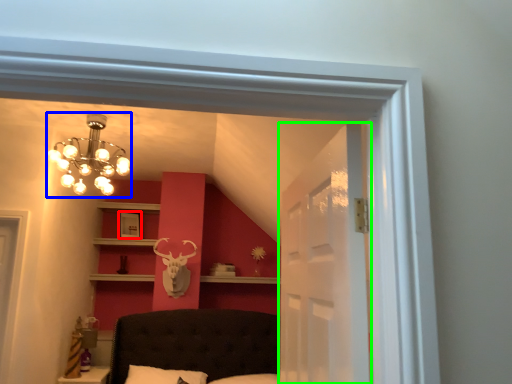
Question: Considering the real-world distances, which object is farthest from picture frame (highlighted by a red box)? lamp (highlighted by a blue box) or glass door (highlighted by a green box)?

Choices:
 (A) lamp
 (B) glass door

Answer: (B)